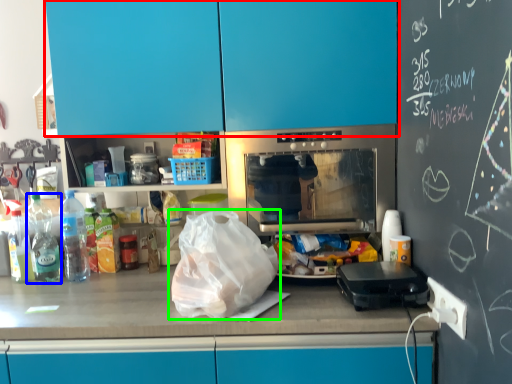
Question: Based on their relative distances, which object is farther from cabinetry (highlighted by a red box)? Choose from bottle (highlighted by a blue box) and plastic bag (highlighted by a green box).

Choices:
 (A) bottle
 (B) plastic bag

Answer: (A)